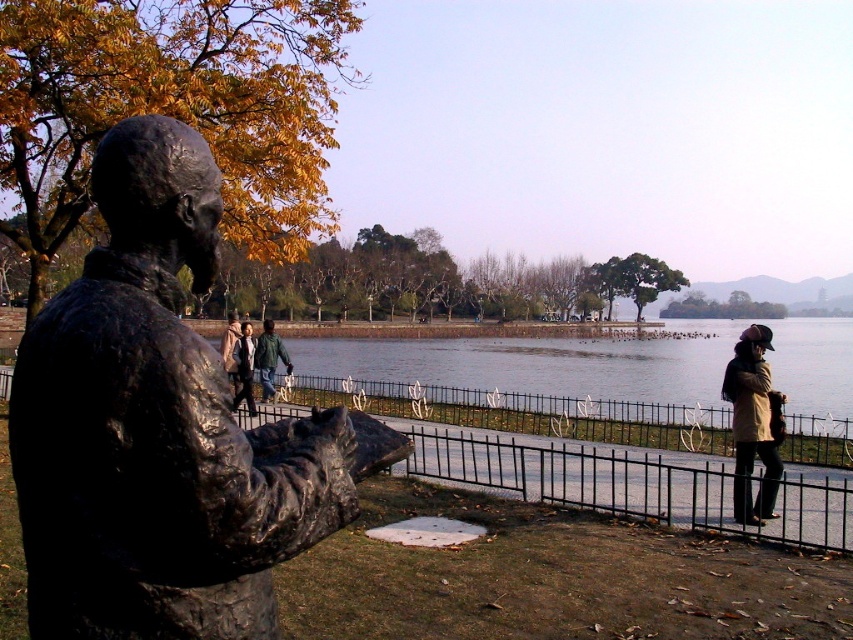
Between black metal fence at lower center and matte black jacket at center, which one appears on the right side from the viewer's perspective?

From the viewer's perspective, black metal fence at lower center appears more on the right side.

Which of these two, black metal fence at lower center or matte black jacket at center, stands shorter?

black metal fence at lower center is shorter.

You are a GUI agent. You are given a task and a screenshot of the screen. Output one action in this format:
    pyautogui.click(x=<x>, y=<y>)
    Task: Click on the black metal fence at lower center
    The width and height of the screenshot is (853, 640).
    Given the screenshot: What is the action you would take?
    pyautogui.click(x=631, y=481)

Looking at this image, who is more distant from viewer, (534, 477) or (751, 420)?

The point (534, 477) is behind.

Can you confirm if black metal fence at lower center is positioned to the left of tan leather jacket at lower right?

Indeed, black metal fence at lower center is positioned on the left side of tan leather jacket at lower right.

Describe the element at coordinates (631, 481) in the screenshot. I see `black metal fence at lower center` at that location.

Where is `black metal fence at lower center`? This screenshot has width=853, height=640. black metal fence at lower center is located at coordinates (631, 481).

Which is more to the left, green fabric jacket at center or matte black jacket at center?

From the viewer's perspective, green fabric jacket at center appears more on the left side.

Can you confirm if green fabric jacket at center is bigger than matte black jacket at center?

No, green fabric jacket at center is not bigger than matte black jacket at center.

Between point (268, 360) and point (242, 380), which one is positioned in front?

Point (242, 380) is more forward.

In order to click on green fabric jacket at center in this screenshot , I will do `click(270, 358)`.